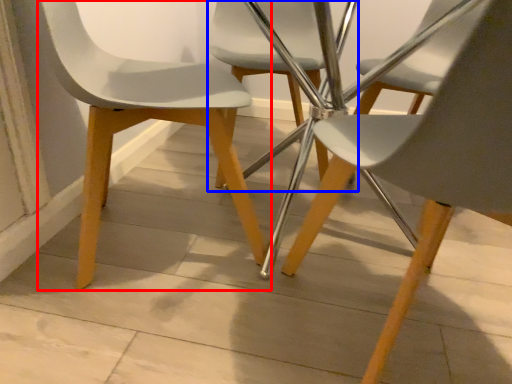
Question: Among these objects, which one is nearest to the camera, chair (highlighted by a red box) or chair (highlighted by a blue box)?

Choices:
 (A) chair
 (B) chair

Answer: (A)